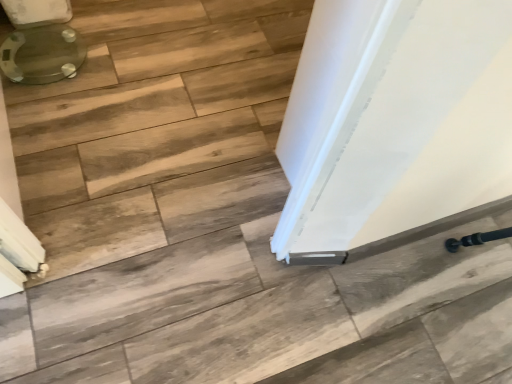
The image size is (512, 384). Find the location of `white glossy door at center`. white glossy door at center is located at coordinates (156, 127).

What is the approximate width of white glossy door at center?

white glossy door at center is 2.60 inches in width.

The height and width of the screenshot is (384, 512). What do you see at coordinates (156, 127) in the screenshot?
I see `white glossy door at center` at bounding box center [156, 127].

The height and width of the screenshot is (384, 512). What do you see at coordinates (40, 42) in the screenshot?
I see `translucent glass toilet at upper left` at bounding box center [40, 42].

You are a GUI agent. You are given a task and a screenshot of the screen. Output one action in this format:
    pyautogui.click(x=<x>, y=<y>)
    Task: Click on the translucent glass toilet at upper left
    The image size is (512, 384).
    Given the screenshot: What is the action you would take?
    pyautogui.click(x=40, y=42)

Where is `white glossy door at center`? Image resolution: width=512 pixels, height=384 pixels. white glossy door at center is located at coordinates (156, 127).

Which is more to the right, translucent glass toilet at upper left or white glossy door at center?

white glossy door at center is more to the right.

Considering their positions, is translucent glass toilet at upper left located in front of or behind white glossy door at center?

translucent glass toilet at upper left is positioned farther from the viewer than white glossy door at center.

Which point is more forward, [3,50] or [191,52]?

The point [3,50] is more forward.

From the image's perspective, which is above, translucent glass toilet at upper left or white glossy door at center?

translucent glass toilet at upper left.

From a real-world perspective, which object rests below the other?

translucent glass toilet at upper left, from a real-world perspective.

Can you confirm if translucent glass toilet at upper left is wider than white glossy door at center?

Yes.

Can you confirm if translucent glass toilet at upper left is taller than white glossy door at center?

In fact, translucent glass toilet at upper left may be shorter than white glossy door at center.

Considering the sizes of objects translucent glass toilet at upper left and white glossy door at center in the image provided, who is bigger, translucent glass toilet at upper left or white glossy door at center?

With larger size is white glossy door at center.

Is white glossy door at center completely or partially inside translucent glass toilet at upper left?

No, white glossy door at center is located outside of translucent glass toilet at upper left.

Can you see translucent glass toilet at upper left touching white glossy door at center?

translucent glass toilet at upper left is not next to white glossy door at center, and they're not touching.

Is translucent glass toilet at upper left oriented towards white glossy door at center?

No, translucent glass toilet at upper left is not facing towards white glossy door at center.

The height and width of the screenshot is (384, 512). In the image, there is a translucent glass toilet at upper left. Identify the location of stair below it (from the image's perspective). (156, 127).

Which is more to the left, white glossy door at center or translucent glass toilet at upper left?

From the viewer's perspective, translucent glass toilet at upper left appears more on the left side.

Is white glossy door at center further to camera compared to translucent glass toilet at upper left?

No, it is not.

Is point (248, 151) less distant than point (64, 35)?

Yes.

From the image's perspective, does white glossy door at center appear higher than translucent glass toilet at upper left?

Answer: Incorrect, from the image's perspective, white glossy door at center is lower than translucent glass toilet at upper left.

From a real-world perspective, does white glossy door at center sit lower than translucent glass toilet at upper left?

Actually, white glossy door at center is physically above translucent glass toilet at upper left in the real world.

Considering the sizes of objects white glossy door at center and translucent glass toilet at upper left in the image provided, who is thinner, white glossy door at center or translucent glass toilet at upper left?

Thinner between the two is white glossy door at center.

Is white glossy door at center taller than translucent glass toilet at upper left?

Indeed, white glossy door at center has a greater height compared to translucent glass toilet at upper left.

Does white glossy door at center have a larger size compared to translucent glass toilet at upper left?

Correct, white glossy door at center is larger in size than translucent glass toilet at upper left.

Would you say translucent glass toilet at upper left is part of white glossy door at center's contents?

Definitely not — translucent glass toilet at upper left is not inside white glossy door at center.

Is white glossy door at center in contact with translucent glass toilet at upper left?

They are not placed beside each other.

Does white glossy door at center turn towards translucent glass toilet at upper left?

Yes, white glossy door at center faces towards translucent glass toilet at upper left.

How many degrees apart are the facing directions of white glossy door at center and translucent glass toilet at upper left?

73.9 degrees.

The width and height of the screenshot is (512, 384). In order to click on stair lying in front of the translucent glass toilet at upper left in this screenshot , I will do `click(156, 127)`.

Find the location of a particular element. stair lying in front of the translucent glass toilet at upper left is located at coordinates (156, 127).

I want to click on toilet below the white glossy door at center (from a real-world perspective), so click(x=40, y=42).